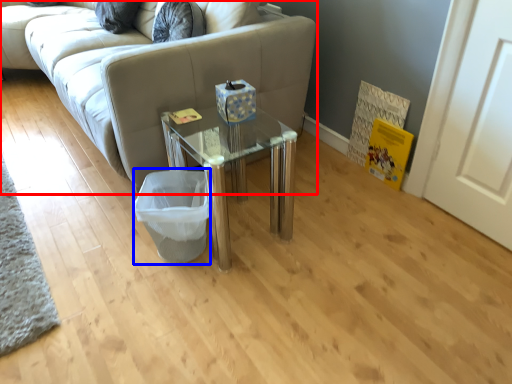
Question: Which of the following is the farthest to the observer, studio couch (highlighted by a red box) or laundry basket (highlighted by a blue box)?

Choices:
 (A) studio couch
 (B) laundry basket

Answer: (B)